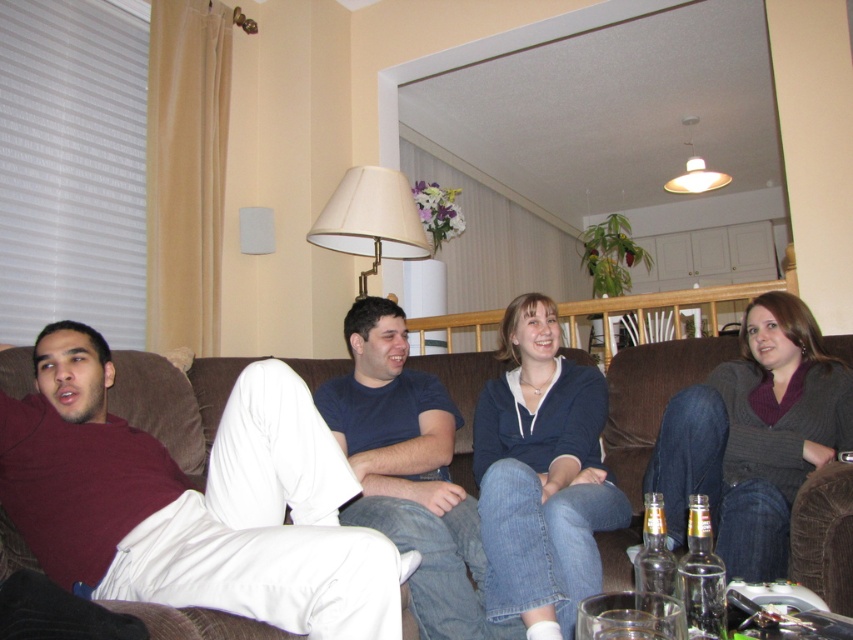
Question: Which object is the closest to the brown fabric couch at center?

Choices:
 (A) clear glass bottle at lower right
 (B) knit sweater at center
 (C) white fabric lampshade at upper center
 (D) maroon cotton shirt at left

Answer: (D)

Question: Can you confirm if dark blue t-shirt at center is positioned below clear glass bottle at lower center?

Choices:
 (A) no
 (B) yes

Answer: (B)

Question: Is dark blue t-shirt at center below white fabric lampshade at upper center?

Choices:
 (A) yes
 (B) no

Answer: (A)

Question: Does blue fleece sweatshirt at center appear on the right side of white fabric lampshade at upper center?

Choices:
 (A) no
 (B) yes

Answer: (B)

Question: Among these points, which one is farthest from the camera?

Choices:
 (A) (515, 378)
 (B) (759, 496)
 (C) (664, 188)

Answer: (C)

Question: Which of the following is the closest to the observer?

Choices:
 (A) (686, 380)
 (B) (666, 476)

Answer: (B)